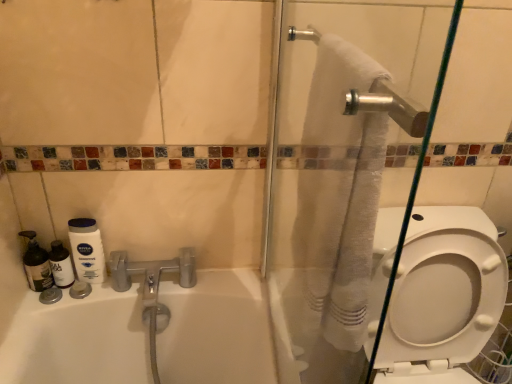
This screenshot has height=384, width=512. Describe the element at coordinates (79, 339) in the screenshot. I see `white glossy bathtub at left` at that location.

Find the location of a particular element. The width and height of the screenshot is (512, 384). white glossy bathtub at left is located at coordinates (79, 339).

Measure the distance between white glossy bathtub at left and camera.

The distance of white glossy bathtub at left from camera is 36.46 inches.

I want to click on white glossy bathtub at left, so click(x=79, y=339).